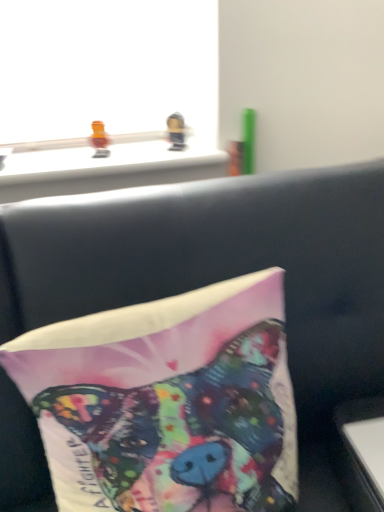
Question: Can you confirm if white glossy table at lower right is shorter than silky fabric pillow at center?

Choices:
 (A) no
 (B) yes

Answer: (B)

Question: Is white glossy table at lower right positioned with its back to silky fabric pillow at center?

Choices:
 (A) no
 (B) yes

Answer: (A)

Question: Does white glossy table at lower right have a greater width compared to silky fabric pillow at center?

Choices:
 (A) yes
 (B) no

Answer: (A)

Question: Is white glossy table at lower right far from silky fabric pillow at center?

Choices:
 (A) yes
 (B) no

Answer: (B)

Question: Considering the relative sizes of white glossy table at lower right and silky fabric pillow at center in the image provided, is white glossy table at lower right thinner than silky fabric pillow at center?

Choices:
 (A) no
 (B) yes

Answer: (A)

Question: Is silky fabric pillow at center wider or thinner than white glossy table at lower right?

Choices:
 (A) wide
 (B) thin

Answer: (B)

Question: Considering the relative positions of silky fabric pillow at center and white glossy table at lower right in the image provided, is silky fabric pillow at center to the left or to the right of white glossy table at lower right?

Choices:
 (A) left
 (B) right

Answer: (A)

Question: From their relative heights in the image, would you say silky fabric pillow at center is taller or shorter than white glossy table at lower right?

Choices:
 (A) tall
 (B) short

Answer: (A)

Question: Is silky fabric pillow at center inside or outside of white glossy table at lower right?

Choices:
 (A) inside
 (B) outside

Answer: (B)

Question: Does point (100, 136) appear closer or farther from the camera than point (380, 496)?

Choices:
 (A) farther
 (B) closer

Answer: (A)

Question: From the image's perspective, relative to white glossy table at lower right, is translucent orange toy at upper left, the 1th toy viewed from the left, above or below?

Choices:
 (A) below
 (B) above

Answer: (B)

Question: Based on their positions, is translucent orange toy at upper left, the 1th toy viewed from the left, located to the left or right of white glossy table at lower right?

Choices:
 (A) right
 (B) left

Answer: (B)

Question: In the image, is translucent orange toy at upper left, the 1th toy viewed from the left, positioned in front of or behind white glossy table at lower right?

Choices:
 (A) front
 (B) behind

Answer: (B)

Question: From the image's perspective, is metallic gold toy at upper center, the 2th toy positioned from the left, above or below white glossy table at lower right?

Choices:
 (A) below
 (B) above

Answer: (B)

Question: Is metallic gold toy at upper center, marked as the 1th toy in a right-to-left arrangement, to the left or to the right of white glossy table at lower right in the image?

Choices:
 (A) right
 (B) left

Answer: (B)